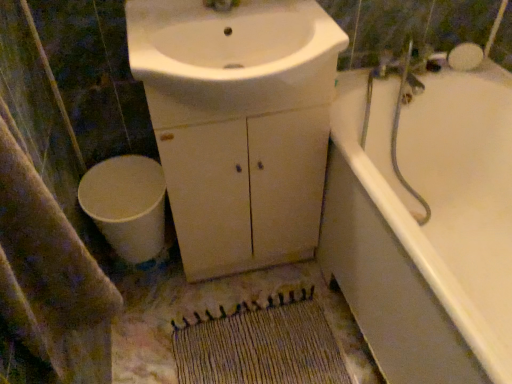
Identify the location of vacant area on top of woven beige mat at lower center (from a real-world perspective). (257, 345).